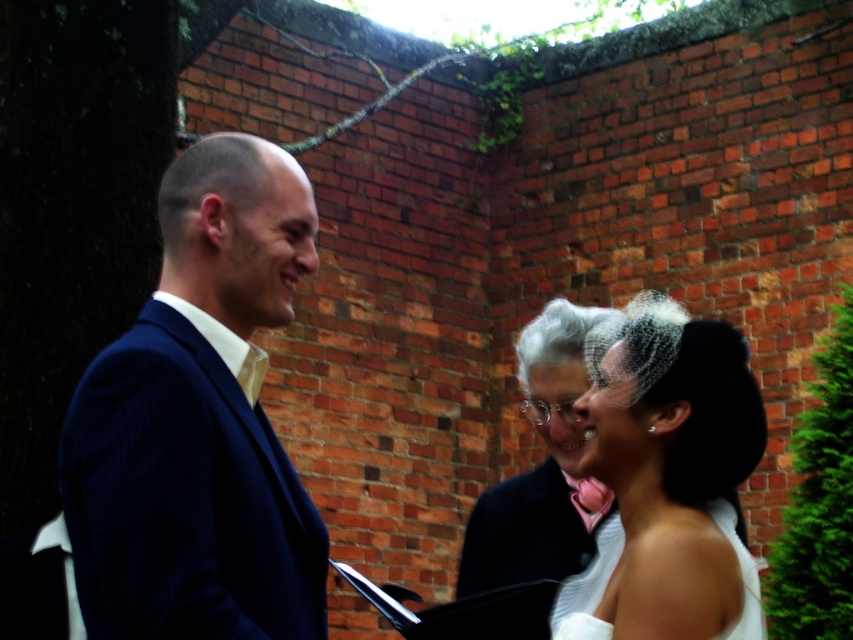
Based on the photo, does matte black suit at center lie behind navy blue suit at left?

No.

Is matte black suit at center thinner than navy blue suit at left?

In fact, matte black suit at center might be wider than navy blue suit at left.

Locate an element on the screen. matte black suit at center is located at coordinates (199, 422).

The height and width of the screenshot is (640, 853). Identify the location of matte black suit at center. (199, 422).

In the scene shown: Does navy blue suit at left appear under white satin veil at center?

No, navy blue suit at left is not below white satin veil at center.

Who is more forward, (131, 508) or (628, 604)?

Positioned in front is point (131, 508).

Who is more forward, (138, 602) or (697, 328)?

Point (138, 602) is in front.

Image resolution: width=853 pixels, height=640 pixels. I want to click on navy blue suit at left, so click(199, 422).

Looking at this image, who is more forward, (183, 433) or (624, 448)?

Point (183, 433) is more forward.

Who is taller, matte black suit at center or white satin veil at center?

With more height is matte black suit at center.

Who is more distant from viewer, (194, 381) or (612, 627)?

The point (612, 627) is more distant.

Image resolution: width=853 pixels, height=640 pixels. Identify the location of matte black suit at center. (199, 422).